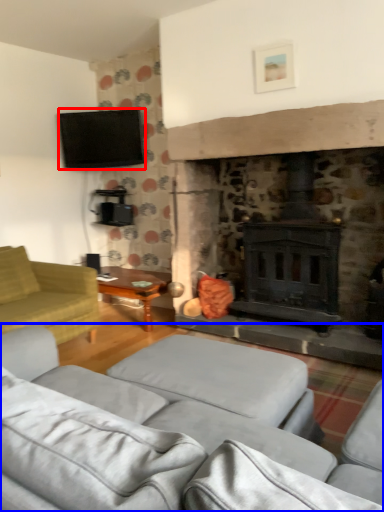
Question: Which object is further to the camera taking this photo, television (highlighted by a red box) or studio couch (highlighted by a blue box)?

Choices:
 (A) television
 (B) studio couch

Answer: (A)